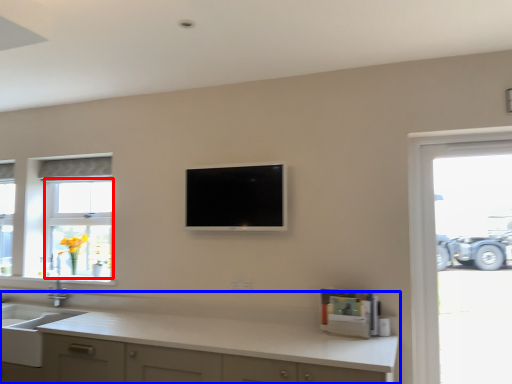
Question: Which object is further to the camera taking this photo, bay window (highlighted by a red box) or countertop (highlighted by a blue box)?

Choices:
 (A) bay window
 (B) countertop

Answer: (A)